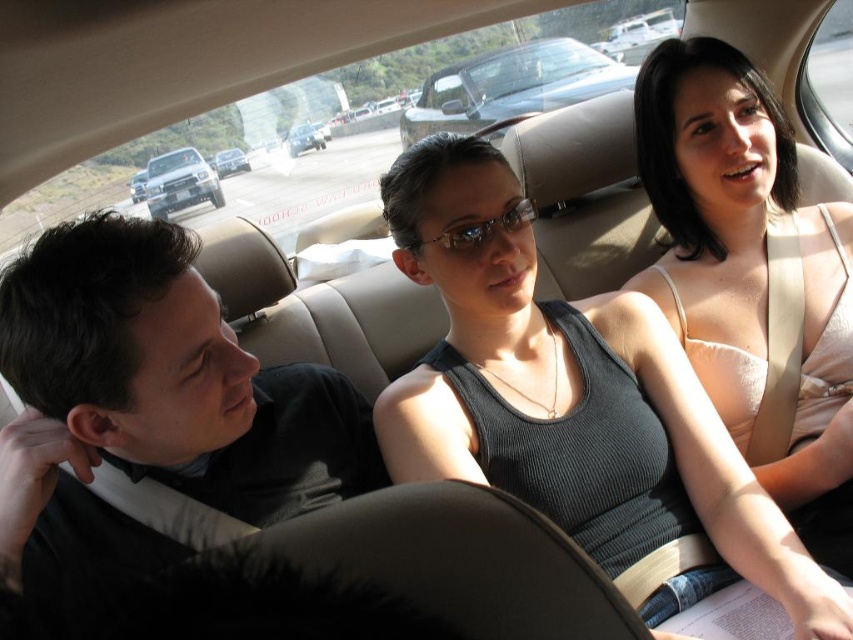
You are a driver who wants to park your car in a parking lot. You see the silver metallic convertible at center and the silver metallic truck at center in the parking lot. Which vehicle should you park above to ensure proper alignment with the parking spot?

You should park above the silver metallic truck at center because the silver metallic convertible at center is already positioned above it, indicating the correct parking alignment.

You are a photographer trying to capture a clear photo of the black matte shirt at left and the silver metallic truck at center in the car interior. Considering their heights, which object should you focus on first to ensure both are in focus?

The black matte shirt at left is taller than the silver metallic truck at center, so you should focus on the black matte shirt at left first to ensure both are in focus.

You are driving a car that needs to park in a garage that can only accommodate vehicles up to 8 feet in length. Based on the scene, can the silver metallic convertible at center and the silver metallic truck at center both fit in the garage if parked side by side?

The silver metallic convertible at center is 8.10 feet from the silver metallic truck at center. Since the garage can only accommodate up to 8 feet, the combined length of both vehicles would exceed the garage capacity, so they cannot both fit side by side.